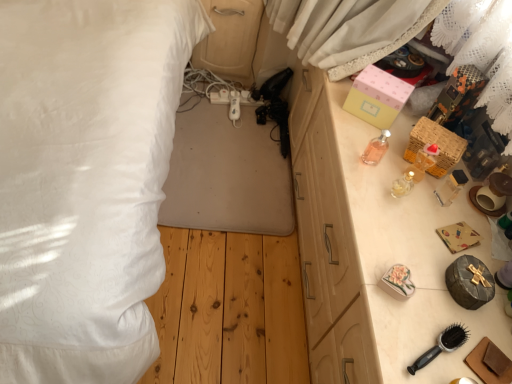
This screenshot has width=512, height=384. I want to click on free space between black plastic hairbrush at lower right and woven wicker basket at right, marked as the second box in a top-to-bottom arrangement, so click(419, 235).